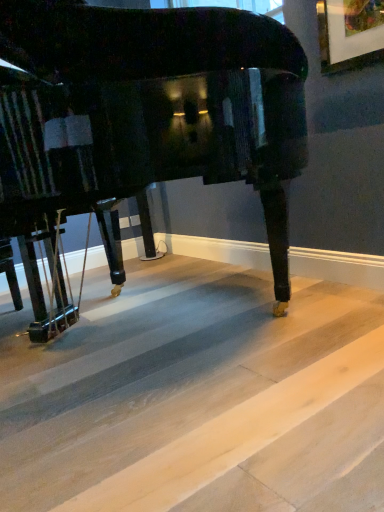
What is the approximate width of glossy black piano at center?

It is 1.60 meters.

Image resolution: width=384 pixels, height=512 pixels. Describe the element at coordinates (141, 121) in the screenshot. I see `glossy black piano at center` at that location.

In order to face glossy black piano at center, should I rotate leftwards or rightwards?

Rotate your view left by about 10.693°.

Locate an element on the screen. glossy black piano at center is located at coordinates (141, 121).

What do you see at coordinates (197, 397) in the screenshot? I see `light wood flooring at lower center` at bounding box center [197, 397].

This screenshot has height=512, width=384. I want to click on light wood flooring at lower center, so click(197, 397).

What is the approximate height of light wood flooring at lower center?

It is 3.66 inches.

You are a GUI agent. You are given a task and a screenshot of the screen. Output one action in this format:
    pyautogui.click(x=<x>, y=<y>)
    Task: Click on the glossy black piano at center
    This screenshot has width=384, height=512.
    Given the screenshot: What is the action you would take?
    pyautogui.click(x=141, y=121)

Is light wood flooring at lower center to the left of glossy black piano at center from the viewer's perspective?

Incorrect, light wood flooring at lower center is not on the left side of glossy black piano at center.

Does light wood flooring at lower center lie in front of glossy black piano at center?

Yes, light wood flooring at lower center is closer to the camera.

Which is in front, point (219, 360) or point (10, 177)?

Point (10, 177)

From the image's perspective, between light wood flooring at lower center and glossy black piano at center, which one is located above?

glossy black piano at center, from the image's perspective.

Consider the image. From a real-world perspective, which object rests below the other?

light wood flooring at lower center, from a real-world perspective.

Can you confirm if light wood flooring at lower center is wider than glossy black piano at center?

Indeed, light wood flooring at lower center has a greater width compared to glossy black piano at center.

Considering the sizes of objects light wood flooring at lower center and glossy black piano at center in the image provided, who is taller, light wood flooring at lower center or glossy black piano at center?

With more height is glossy black piano at center.

Based on the photo, considering the relative sizes of light wood flooring at lower center and glossy black piano at center in the image provided, is light wood flooring at lower center bigger than glossy black piano at center?

No, light wood flooring at lower center is not bigger than glossy black piano at center.

Is glossy black piano at center located within light wood flooring at lower center?

No, light wood flooring at lower center does not contain glossy black piano at center.

Is light wood flooring at lower center placed right next to glossy black piano at center?

No.

Is light wood flooring at lower center positioned with its back to glossy black piano at center?

No, glossy black piano at center is not at the back of light wood flooring at lower center.

At what (x,y) coordinates should I click in order to perform the action: click on piano on the left of light wood flooring at lower center. Please return your answer as a coordinate pair (x, y). Image resolution: width=384 pixels, height=512 pixels. Looking at the image, I should click on (141, 121).

Which is more to the left, glossy black piano at center or light wood flooring at lower center?

Positioned to the left is glossy black piano at center.

Is glossy black piano at center further to camera compared to light wood flooring at lower center?

That is True.

Considering the points (224, 29) and (227, 278), which point is in front, point (224, 29) or point (227, 278)?

The point (224, 29) is in front.

From the image's perspective, who appears lower, glossy black piano at center or light wood flooring at lower center?

From the image's view, light wood flooring at lower center is below.

From a real-world perspective, which is physically below, glossy black piano at center or light wood flooring at lower center?

light wood flooring at lower center is physically lower.

From the picture: Considering the sizes of glossy black piano at center and light wood flooring at lower center in the image, is glossy black piano at center wider or thinner than light wood flooring at lower center?

glossy black piano at center is thinner than light wood flooring at lower center.

Is glossy black piano at center taller or shorter than light wood flooring at lower center?

Considering their sizes, glossy black piano at center has more height than light wood flooring at lower center.

Between glossy black piano at center and light wood flooring at lower center, which one has larger size?

glossy black piano at center is bigger.

Is glossy black piano at center surrounding light wood flooring at lower center?

No.

Is glossy black piano at center not close to light wood flooring at lower center?

No, glossy black piano at center is not far away from light wood flooring at lower center.

Is light wood flooring at lower center at the back of glossy black piano at center?

glossy black piano at center does not have its back to light wood flooring at lower center.

How much distance is there between glossy black piano at center and light wood flooring at lower center?

73.45 centimeters.

I want to click on concrete beneath the glossy black piano at center (from a real-world perspective), so click(197, 397).

The image size is (384, 512). I want to click on piano above the light wood flooring at lower center (from a real-world perspective), so click(x=141, y=121).

Where is `concrete that is under the glossy black piano at center (from a real-world perspective)`? The image size is (384, 512). concrete that is under the glossy black piano at center (from a real-world perspective) is located at coordinates (197, 397).